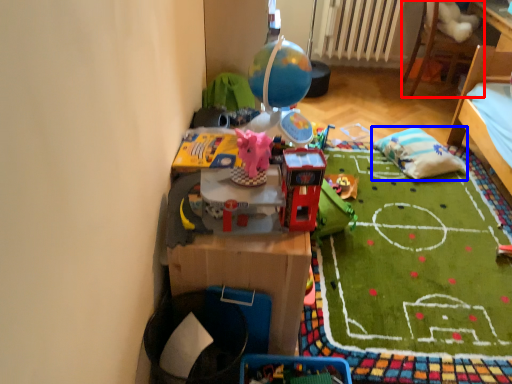
Question: Which of the following is the closest to the observer, furniture (highlighted by a red box) or pillow (highlighted by a blue box)?

Choices:
 (A) furniture
 (B) pillow

Answer: (B)